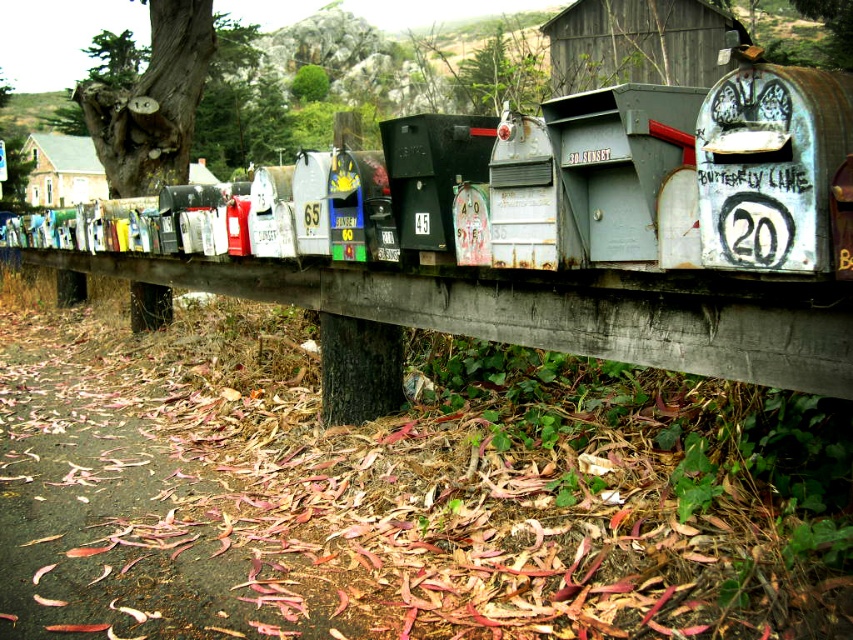
You are a delivery person trying to place a package between the wooden rail at center and the matte black mailbox at center. The package measures 24 inches in length. Will it fit in the space between them?

The wooden rail at center is 25.76 inches away from the matte black mailbox at center. Since the package is 24 inches long, it will fit in the space between them as there is enough room.